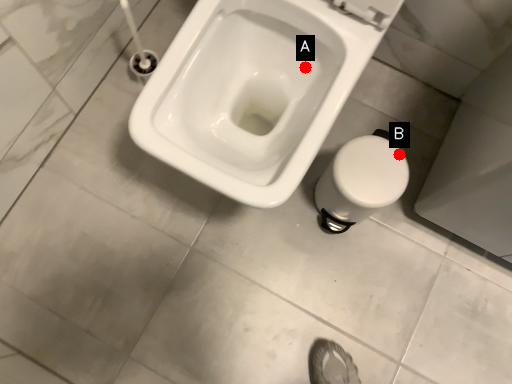
Question: Two points are circled on the image, labeled by A and B beside each circle. Which point appears farthest from the camera in this image?

Choices:
 (A) A is further
 (B) B is further

Answer: (B)